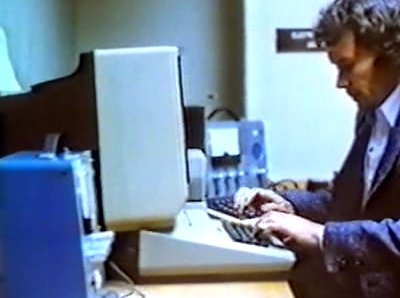
What are the coordinates of `wall` in the screenshot? It's located at (40, 29), (102, 27), (298, 90).